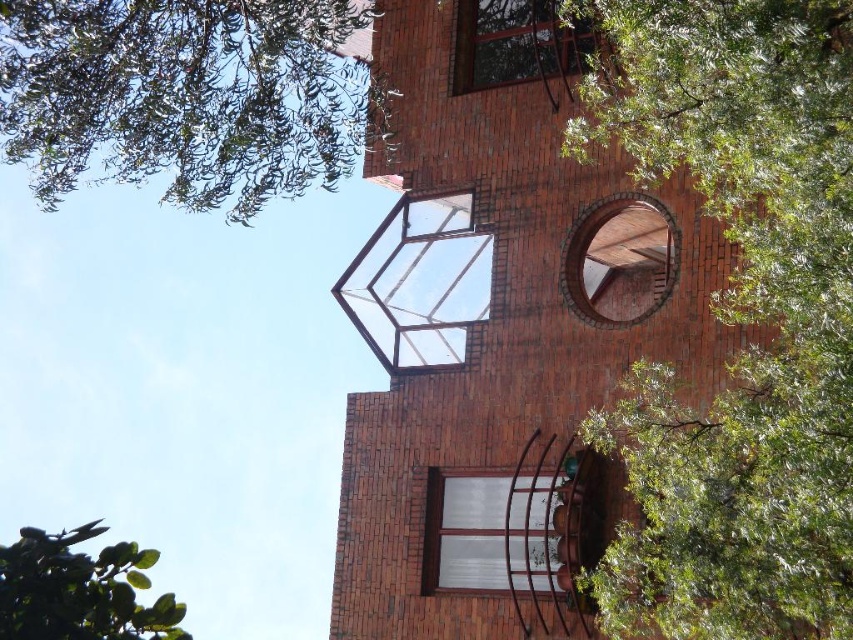
Can you confirm if green leafy tree at upper left is positioned below white glass window at center?

No, green leafy tree at upper left is not below white glass window at center.

This screenshot has height=640, width=853. What are the coordinates of `green leafy tree at upper left` in the screenshot? It's located at (187, 97).

Find the location of a particular element. green leafy tree at upper left is located at coordinates (187, 97).

Does red brick tower at center have a lesser height compared to green leafy tree at upper left?

In fact, red brick tower at center may be taller than green leafy tree at upper left.

Find the location of `red brick tower at center`. red brick tower at center is located at coordinates (604, 326).

Measure the distance between red brick tower at center and camera.

red brick tower at center and camera are 30.01 feet apart from each other.

Find the location of a particular element. red brick tower at center is located at coordinates (604, 326).

Which is below, clear glass window at center or red brick window at upper right?

Positioned lower is clear glass window at center.

Who is positioned more to the left, clear glass window at center or red brick window at upper right?

Positioned to the left is clear glass window at center.

Is point (383, 358) positioned behind point (561, 257)?

Yes, point (383, 358) is behind point (561, 257).

You are a GUI agent. You are given a task and a screenshot of the screen. Output one action in this format:
    pyautogui.click(x=<x>, y=<y>)
    Task: Click on the clear glass window at center
    The width and height of the screenshot is (853, 640).
    Given the screenshot: What is the action you would take?
    pyautogui.click(x=419, y=282)